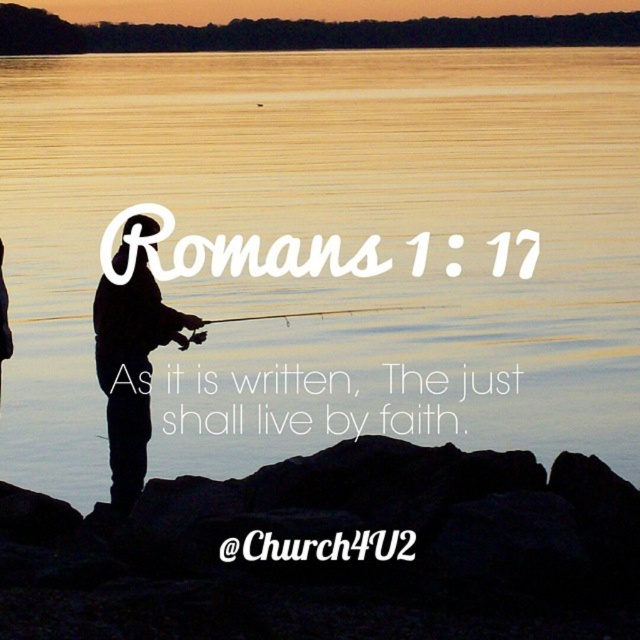
Is point (344, 54) farther from camera compared to point (4, 305)?

Yes.

Between point (364, 92) and point (1, 324), which one is positioned in front?

Point (1, 324) is in front.

I want to click on silvery water at center, so click(x=342, y=250).

Can you confirm if matte black fishing pole at center is wider than matte black fishing rod at left?

Indeed, matte black fishing pole at center has a greater width compared to matte black fishing rod at left.

Which is in front, point (326, 310) or point (8, 352)?

Point (326, 310) is more forward.

This screenshot has width=640, height=640. I want to click on matte black fishing pole at center, so click(x=316, y=314).

Does black matte fisherman at center appear on the left side of matte black fishing rod at left?

In fact, black matte fisherman at center is to the right of matte black fishing rod at left.

Who is shorter, black matte fisherman at center or matte black fishing rod at left?

matte black fishing rod at left is shorter.

Is point (147, 435) more distant than point (12, 344)?

No, it is in front of (12, 344).

Identify the location of black matte fisherman at center. (131, 369).